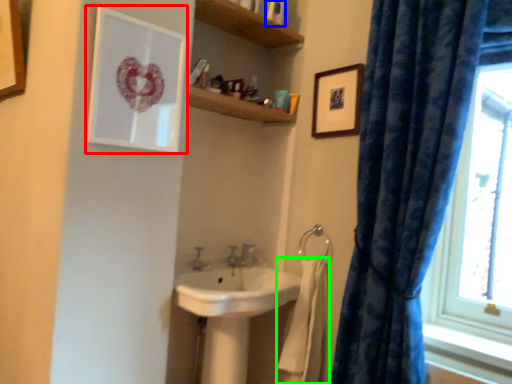
Question: Which object is positioned farthest from picture frame (highlighted by a red box)? Select from toiletry (highlighted by a blue box) and bath towel (highlighted by a green box).

Choices:
 (A) toiletry
 (B) bath towel

Answer: (B)